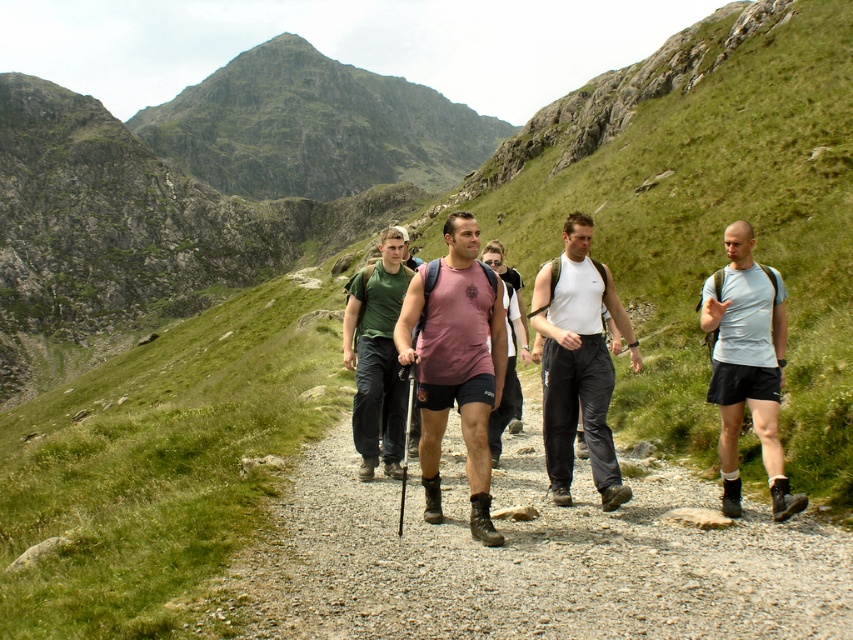
Does rugged granite peak at upper center have a greater height compared to green fabric shirt at center?

Yes.

Who is more distant from viewer, [477,138] or [381,262]?

The point [477,138] is behind.

This screenshot has width=853, height=640. What are the coordinates of `rugged granite peak at upper center` in the screenshot? It's located at (314, 128).

Between white matte t-shirt at right and green fabric shirt at center, which one is positioned higher?

green fabric shirt at center

Which is behind, point (735, 332) or point (364, 436)?

Positioned behind is point (364, 436).

The height and width of the screenshot is (640, 853). In order to click on white matte t-shirt at right in this screenshot , I will do `click(747, 365)`.

Which is behind, point (569, 262) or point (720, 419)?

Positioned behind is point (569, 262).

What do you see at coordinates (578, 362) in the screenshot?
I see `white matte shirt at center` at bounding box center [578, 362].

Who is more distant from viewer, (543,380) or (764,273)?

The point (543,380) is more distant.

The height and width of the screenshot is (640, 853). Find the location of `white matte shirt at center`. white matte shirt at center is located at coordinates (578, 362).